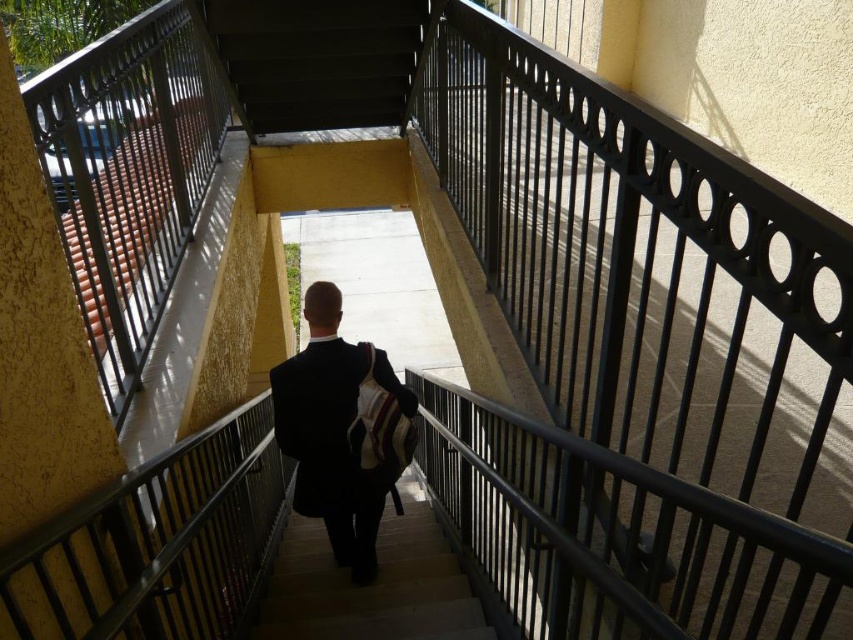
Between point (258, 72) and point (341, 605), which one is positioned in front?

Point (341, 605) is more forward.

Does dark gray metal stairwell at center have a greater width compared to wooden stairs at center?

Yes, dark gray metal stairwell at center is wider than wooden stairs at center.

The image size is (853, 640). Identify the location of dark gray metal stairwell at center. (318, 60).

Who is more distant from viewer, [358,346] or [258,609]?

The point [258,609] is behind.

Consider the image. Does dark suit at center have a larger size compared to wooden stairs at center?

No.

The width and height of the screenshot is (853, 640). Identify the location of dark suit at center. (337, 432).

Does dark gray metal stairwell at center have a lesser height compared to dark suit at center?

Yes, dark gray metal stairwell at center is shorter than dark suit at center.

Is dark gray metal stairwell at center below dark suit at center?

Actually, dark gray metal stairwell at center is above dark suit at center.

You are a GUI agent. You are given a task and a screenshot of the screen. Output one action in this format:
    pyautogui.click(x=<x>, y=<y>)
    Task: Click on the dark gray metal stairwell at center
    This screenshot has width=853, height=640.
    Given the screenshot: What is the action you would take?
    pyautogui.click(x=318, y=60)